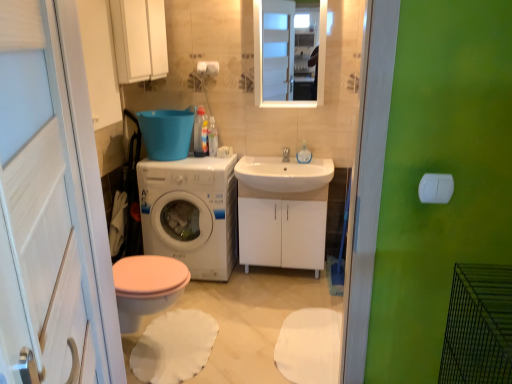
The image size is (512, 384). In order to click on free space in front of translucent plastic bottle at center in this screenshot , I will do `click(200, 161)`.